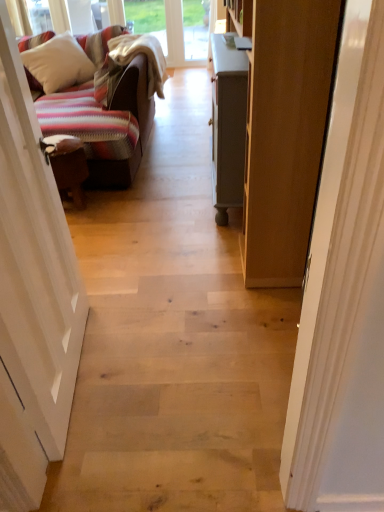
What do you see at coordinates (344, 296) in the screenshot? The height and width of the screenshot is (512, 384). I see `white painted wood door at right, the first door from the right` at bounding box center [344, 296].

This screenshot has height=512, width=384. Describe the element at coordinates (56, 63) in the screenshot. I see `white soft pillow at upper left` at that location.

This screenshot has height=512, width=384. I want to click on white painted wood door at right, arranged as the 2th door when viewed from the left, so click(344, 296).

Which of these two, white painted wood door at right, arranged as the 2th door when viewed from the left, or white wood door at left, the 2th door viewed from the right, is smaller?

white painted wood door at right, arranged as the 2th door when viewed from the left, is smaller.

Could white wood door at left, the 1th door viewed from the left, be considered to be inside white painted wood door at right, arranged as the 2th door when viewed from the left?

No, white wood door at left, the 1th door viewed from the left, is located outside of white painted wood door at right, arranged as the 2th door when viewed from the left.

Is white painted wood door at right, the first door from the right, at the left side of white wood door at left, the 1th door viewed from the left?

No, white painted wood door at right, the first door from the right, is not to the left of white wood door at left, the 1th door viewed from the left.

The image size is (384, 512). In order to click on pillow that appears above the white painted wood door at right, arranged as the 2th door when viewed from the left (from the image's perspective) in this screenshot , I will do `click(56, 63)`.

Does white painted wood door at right, the first door from the right, have a greater height compared to white soft pillow at upper left?

Yes, white painted wood door at right, the first door from the right, is taller than white soft pillow at upper left.

Considering the relative sizes of white painted wood door at right, arranged as the 2th door when viewed from the left, and white soft pillow at upper left in the image provided, is white painted wood door at right, arranged as the 2th door when viewed from the left, smaller than white soft pillow at upper left?

Yes.

Based on the photo, looking at their sizes, would you say white painted wood door at right, arranged as the 2th door when viewed from the left, is wider or thinner than white soft pillow at upper left?

Clearly, white painted wood door at right, arranged as the 2th door when viewed from the left, has less width compared to white soft pillow at upper left.

Considering the points (32, 151) and (344, 236), which point is in front, point (32, 151) or point (344, 236)?

Positioned in front is point (344, 236).

This screenshot has height=512, width=384. In order to click on door that appears above the white painted wood door at right, the first door from the right (from a real-world perspective) in this screenshot , I will do `click(32, 296)`.

Considering the relative sizes of white wood door at left, the 1th door viewed from the left, and white painted wood door at right, the first door from the right, in the image provided, is white wood door at left, the 1th door viewed from the left, thinner than white painted wood door at right, the first door from the right,?

In fact, white wood door at left, the 1th door viewed from the left, might be wider than white painted wood door at right, the first door from the right.

Which of these two, white wood door at left, the 2th door viewed from the right, or white soft pillow at upper left, stands taller?

Standing taller between the two is white wood door at left, the 2th door viewed from the right.

Which is in front, white wood door at left, the 2th door viewed from the right, or white soft pillow at upper left?

Positioned in front is white wood door at left, the 2th door viewed from the right.

From a real-world perspective, is white wood door at left, the 2th door viewed from the right, beneath white soft pillow at upper left?

No, from a real-world perspective, white wood door at left, the 2th door viewed from the right, is not beneath white soft pillow at upper left.

Is white wood door at left, the 2th door viewed from the right, with white soft pillow at upper left?

There is a gap between white wood door at left, the 2th door viewed from the right, and white soft pillow at upper left.

Where is `the 2nd door below the white soft pillow at upper left (from the image's perspective)`? The height and width of the screenshot is (512, 384). the 2nd door below the white soft pillow at upper left (from the image's perspective) is located at coordinates [32, 296].

Does point (45, 44) appear closer or farther from the camera than point (37, 257)?

Point (45, 44) appears to be farther away from the viewer than point (37, 257).

Is white wood door at left, the 1th door viewed from the left, at the back of white soft pillow at upper left?

white soft pillow at upper left is not turned away from white wood door at left, the 1th door viewed from the left.

From the image's perspective, which is below, white soft pillow at upper left or white wood door at left, the 2th door viewed from the right?

white wood door at left, the 2th door viewed from the right, appears lower in the image.

Between white soft pillow at upper left and white painted wood door at right, arranged as the 2th door when viewed from the left, which one appears on the left side from the viewer's perspective?

Positioned to the left is white soft pillow at upper left.

Is white soft pillow at upper left not inside white painted wood door at right, the first door from the right?

Yes.

From a real-world perspective, is white soft pillow at upper left beneath white painted wood door at right, arranged as the 2th door when viewed from the left?

Yes, from a real-world perspective, white soft pillow at upper left is beneath white painted wood door at right, arranged as the 2th door when viewed from the left.

Considering the positions of points (56, 85) and (365, 60), is point (56, 85) closer to camera compared to point (365, 60)?

No, it is behind (365, 60).

Where is `door below the white wood door at left, the 1th door viewed from the left (from a real-world perspective)`? door below the white wood door at left, the 1th door viewed from the left (from a real-world perspective) is located at coordinates (344, 296).

Where is `the 2nd door counting from the right side of the white soft pillow at upper left`? Image resolution: width=384 pixels, height=512 pixels. the 2nd door counting from the right side of the white soft pillow at upper left is located at coordinates (344, 296).

Which object lies further to the anchor point white soft pillow at upper left, white painted wood door at right, the first door from the right, or white wood door at left, the 2th door viewed from the right?

Based on the image, white painted wood door at right, the first door from the right, appears to be further to white soft pillow at upper left.

When comparing their distances from white painted wood door at right, the first door from the right, does white soft pillow at upper left or white wood door at left, the 2th door viewed from the right, seem closer?

Based on the image, white wood door at left, the 2th door viewed from the right, appears to be nearer to white painted wood door at right, the first door from the right.

Estimate the real-world distances between objects in this image. Which object is further from white soft pillow at upper left, white wood door at left, the 1th door viewed from the left, or white painted wood door at right, arranged as the 2th door when viewed from the left?

The object further to white soft pillow at upper left is white painted wood door at right, arranged as the 2th door when viewed from the left.

Based on their spatial positions, is white wood door at left, the 1th door viewed from the left, or white soft pillow at upper left further from white painted wood door at right, the first door from the right?

white soft pillow at upper left is positioned further to the anchor white painted wood door at right, the first door from the right.

Based on their spatial positions, is white painted wood door at right, the first door from the right, or white soft pillow at upper left closer to white wood door at left, the 1th door viewed from the left?

white painted wood door at right, the first door from the right.

From the image, which object appears to be nearer to white wood door at left, the 1th door viewed from the left, white soft pillow at upper left or white painted wood door at right, the first door from the right?

white painted wood door at right, the first door from the right, is closer to white wood door at left, the 1th door viewed from the left.

At what (x,y) coordinates should I click in order to perform the action: click on door located between white wood door at left, the 2th door viewed from the right, and white soft pillow at upper left in the depth direction. Please return your answer as a coordinate pair (x, y). The height and width of the screenshot is (512, 384). Looking at the image, I should click on (344, 296).